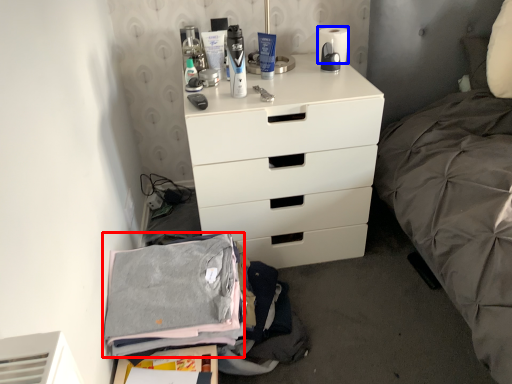
Question: Which object appears farthest to the camera in this image, clothing (highlighted by a red box) or toilet paper (highlighted by a blue box)?

Choices:
 (A) clothing
 (B) toilet paper

Answer: (B)